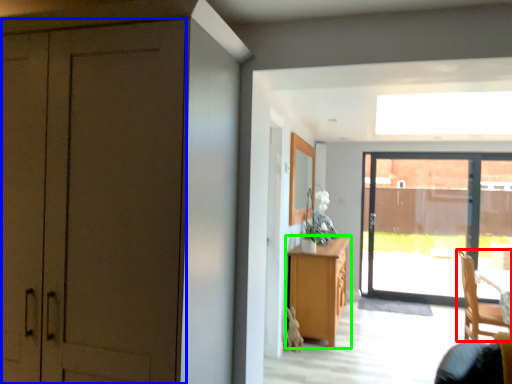
Question: Estimate the real-world distances between objects in this image. Which object is closer to chair (highlighted by a red box), door (highlighted by a blue box) or cabinetry (highlighted by a green box)?

Choices:
 (A) door
 (B) cabinetry

Answer: (B)